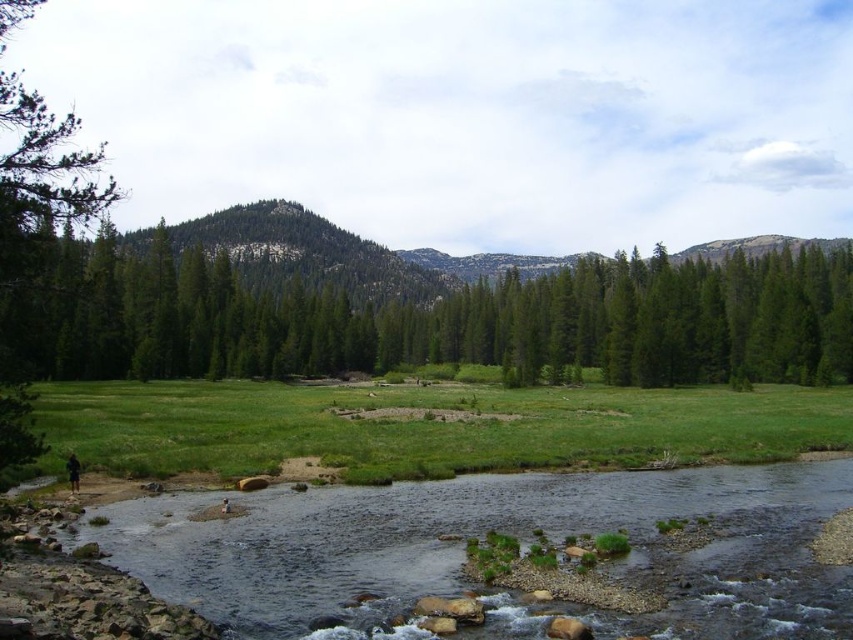
Question: Among these points, which one is nearest to the camera?

Choices:
 (A) (335, 413)
 (B) (424, 310)

Answer: (A)

Question: Does green matte tree at center have a larger size compared to green grassy field at lower center?

Choices:
 (A) no
 (B) yes

Answer: (B)

Question: Can you confirm if green matte tree at center is wider than clear water at river center?

Choices:
 (A) no
 (B) yes

Answer: (B)

Question: Considering the relative positions of clear water at river center and green grassy field at lower center in the image provided, where is clear water at river center located with respect to green grassy field at lower center?

Choices:
 (A) left
 (B) right

Answer: (A)

Question: Which of the following is the closest to the observer?

Choices:
 (A) green grassy field at lower center
 (B) green matte tree at center

Answer: (B)

Question: Which object is farther from the camera taking this photo?

Choices:
 (A) clear water at river center
 (B) green grassy field at lower center

Answer: (B)